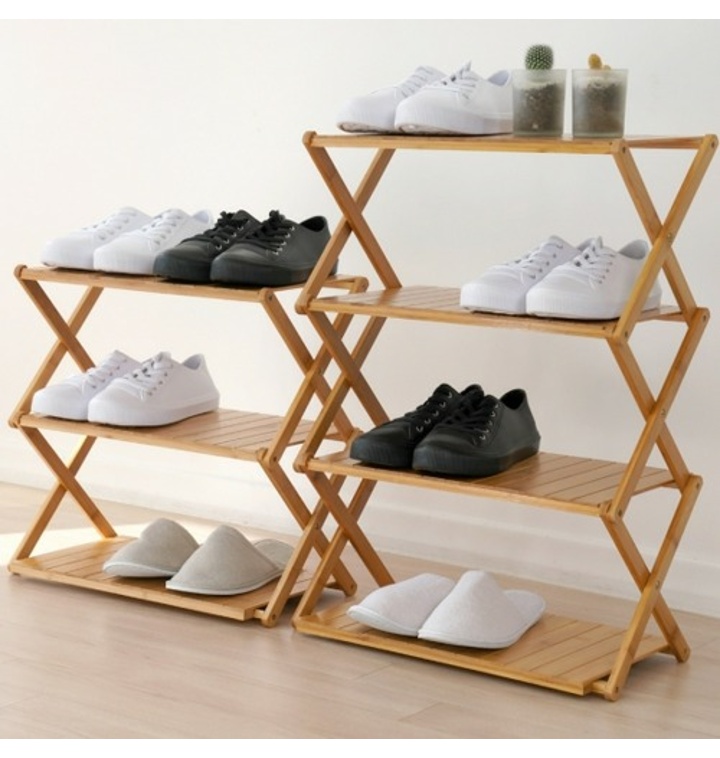
Locate an element on the screen. wooden shelves is located at coordinates (518, 143), (392, 305), (525, 495), (526, 675), (212, 445), (206, 287), (53, 575).